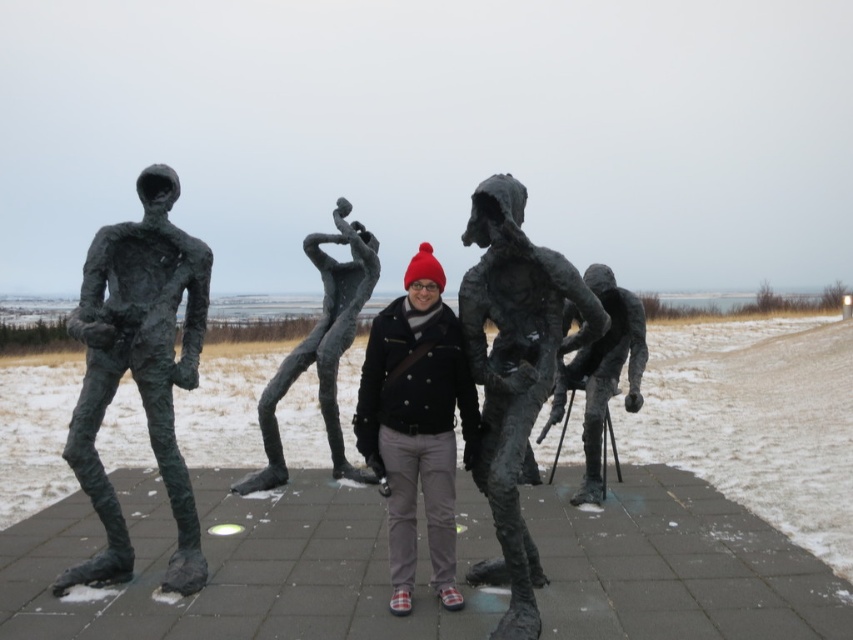
Who is taller, bronze textured figure at center or bronze textured sculpture at center?

With more height is bronze textured sculpture at center.

Who is more forward, (476, 470) or (318, 323)?

Point (476, 470)

You are a GUI agent. You are given a task and a screenshot of the screen. Output one action in this format:
    pyautogui.click(x=<x>, y=<y>)
    Task: Click on the bronze textured figure at center
    Image resolution: width=853 pixels, height=640 pixels.
    Given the screenshot: What is the action you would take?
    pyautogui.click(x=514, y=372)

Can you confirm if matte black jacket at center is positioned above bronze sculpture at center?

Yes, matte black jacket at center is above bronze sculpture at center.

Can you confirm if matte black jacket at center is bigger than bronze sculpture at center?

No, matte black jacket at center is not bigger than bronze sculpture at center.

Identify the location of matte black jacket at center. The width and height of the screenshot is (853, 640). (416, 422).

Who is lower down, bronze textured sculpture at center or bronze sculpture at center?

bronze sculpture at center is lower down.

From the picture: Who is more forward, (305, 250) or (631, 371)?

Point (631, 371) is in front.

This screenshot has width=853, height=640. I want to click on bronze textured sculpture at center, so click(x=321, y=349).